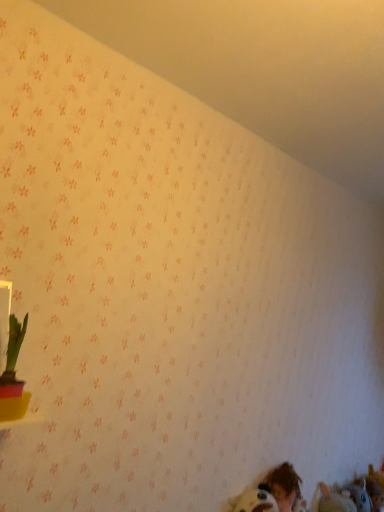
Measure the distance between fuzzy brown stuffed toy at lower right, the 1th animal when ordered from left to right, and camera.

The depth of fuzzy brown stuffed toy at lower right, the 1th animal when ordered from left to right, is 1.84 meters.

I want to click on green leafy plant in pink pot at left, so click(x=13, y=375).

This screenshot has height=512, width=384. Identify the location of brown plush toy at lower right, which is the second animal in front-to-back order. (375, 488).

Is brown plush toy at lower right, which is the second animal in front-to-back order, directly adjacent to green leafy plant in pink pot at left?

They are not placed beside each other.

Is brown plush toy at lower right, which is the second animal in front-to-back order, positioned with its back to green leafy plant in pink pot at left?

No, brown plush toy at lower right, which is the second animal in front-to-back order, is not facing away from green leafy plant in pink pot at left.

From the image's perspective, is brown plush toy at lower right, which is the second animal in front-to-back order, under green leafy plant in pink pot at left?

Yes, from the image's perspective, brown plush toy at lower right, which is the second animal in front-to-back order, is below green leafy plant in pink pot at left.

Is fuzzy brown stuffed toy at lower right, the second animal positioned from the right, located within green leafy plant in pink pot at left?

That's incorrect, fuzzy brown stuffed toy at lower right, the second animal positioned from the right, is not inside green leafy plant in pink pot at left.

From the image's perspective, is green leafy plant in pink pot at left positioned above or below fuzzy brown stuffed toy at lower right, the second animal positioned from the right?

green leafy plant in pink pot at left is situated higher than fuzzy brown stuffed toy at lower right, the second animal positioned from the right, in the image.

Is green leafy plant in pink pot at left taller or shorter than fuzzy brown stuffed toy at lower right, the 1th animal when ordered from left to right?

Clearly, green leafy plant in pink pot at left is taller compared to fuzzy brown stuffed toy at lower right, the 1th animal when ordered from left to right.

From a real-world perspective, is brown hair at lower right over green leafy plant in pink pot at left?

No, from a real-world perspective, brown hair at lower right is not above green leafy plant in pink pot at left.

Between point (290, 464) and point (3, 415), which one is positioned in front?

The point (3, 415) is closer to the camera.

Does brown hair at lower right turn towards green leafy plant in pink pot at left?

No, brown hair at lower right is not facing towards green leafy plant in pink pot at left.

Which of these two, brown hair at lower right or green leafy plant in pink pot at left, stands taller?

With more height is brown hair at lower right.

From the picture: How far apart are brown hair at lower right and brown plush toy at lower right, which is counted as the 1th animal, starting from the back?

brown hair at lower right and brown plush toy at lower right, which is counted as the 1th animal, starting from the back, are 26.25 inches apart from each other.

Is brown hair at lower right positioned before brown plush toy at lower right, arranged as the 2th animal when viewed from the left?

Yes, it is in front of brown plush toy at lower right, arranged as the 2th animal when viewed from the left.

Can you confirm if brown hair at lower right is bigger than brown plush toy at lower right, which appears as the first animal when viewed from the right?

Correct, brown hair at lower right is larger in size than brown plush toy at lower right, which appears as the first animal when viewed from the right.

Considering the positions of points (271, 480) and (369, 493), is point (271, 480) farther from camera compared to point (369, 493)?

No, (271, 480) is closer to viewer.

Is point (292, 490) closer to camera compared to point (320, 508)?

Yes, point (292, 490) is in front of point (320, 508).

Consider the image. Is brown hair at lower right taller than fuzzy brown stuffed toy at lower right, marked as the 2th animal in a back-to-front arrangement?

Indeed, brown hair at lower right has a greater height compared to fuzzy brown stuffed toy at lower right, marked as the 2th animal in a back-to-front arrangement.

Considering their positions, is brown hair at lower right located in front of or behind fuzzy brown stuffed toy at lower right, the second animal positioned from the right?

Clearly, brown hair at lower right is in front of fuzzy brown stuffed toy at lower right, the second animal positioned from the right.

How far apart are brown hair at lower right and fuzzy brown stuffed toy at lower right, the 1th animal when ordered from left to right?

11.24 inches.

Considering the positions of points (328, 494) and (368, 479), is point (328, 494) farther from camera compared to point (368, 479)?

No.

Consider the image. Considering the relative positions of fuzzy brown stuffed toy at lower right, which is the 1th animal in front-to-back order, and brown plush toy at lower right, which is the second animal in front-to-back order, in the image provided, is fuzzy brown stuffed toy at lower right, which is the 1th animal in front-to-back order, to the right of brown plush toy at lower right, which is the second animal in front-to-back order, from the viewer's perspective?

No, fuzzy brown stuffed toy at lower right, which is the 1th animal in front-to-back order, is not to the right of brown plush toy at lower right, which is the second animal in front-to-back order.

Is fuzzy brown stuffed toy at lower right, marked as the 2th animal in a back-to-front arrangement, turned away from brown plush toy at lower right, which appears as the first animal when viewed from the right?

No, fuzzy brown stuffed toy at lower right, marked as the 2th animal in a back-to-front arrangement, is not facing away from brown plush toy at lower right, which appears as the first animal when viewed from the right.

From the image's perspective, is fuzzy brown stuffed toy at lower right, the 1th animal when ordered from left to right, above or below brown plush toy at lower right, which is counted as the 1th animal, starting from the back?

fuzzy brown stuffed toy at lower right, the 1th animal when ordered from left to right, is situated higher than brown plush toy at lower right, which is counted as the 1th animal, starting from the back, in the image.

Which object is closer to the camera taking this photo, green leafy plant in pink pot at left or brown hair at lower right?

green leafy plant in pink pot at left is closer to the camera.

From a real-world perspective, is green leafy plant in pink pot at left under brown hair at lower right?

Incorrect, from a real-world perspective, green leafy plant in pink pot at left is higher than brown hair at lower right.

Considering the sizes of objects green leafy plant in pink pot at left and brown hair at lower right in the image provided, who is smaller, green leafy plant in pink pot at left or brown hair at lower right?

green leafy plant in pink pot at left is smaller.

Is green leafy plant in pink pot at left to the right of brown hair at lower right from the viewer's perspective?

In fact, green leafy plant in pink pot at left is to the left of brown hair at lower right.

Where is `animal that is the 1st one below the green leafy plant in pink pot at left (from a real-world perspective)`? This screenshot has width=384, height=512. animal that is the 1st one below the green leafy plant in pink pot at left (from a real-world perspective) is located at coordinates (375, 488).

In order to click on houseplant that appears above the fuzzy brown stuffed toy at lower right, the second animal positioned from the right (from the image's perspective) in this screenshot , I will do `click(13, 375)`.

Which object lies nearer to the anchor point brown hair at lower right, brown plush toy at lower right, which is counted as the 1th animal, starting from the back, or fuzzy brown stuffed toy at lower right, marked as the 2th animal in a back-to-front arrangement?

Among the two, fuzzy brown stuffed toy at lower right, marked as the 2th animal in a back-to-front arrangement, is located nearer to brown hair at lower right.

Based on their spatial positions, is fuzzy brown stuffed toy at lower right, the second animal positioned from the right, or brown plush toy at lower right, which appears as the first animal when viewed from the right, closer to green leafy plant in pink pot at left?

fuzzy brown stuffed toy at lower right, the second animal positioned from the right, lies closer to green leafy plant in pink pot at left than the other object.

When comparing their distances from green leafy plant in pink pot at left, does fuzzy brown stuffed toy at lower right, marked as the 2th animal in a back-to-front arrangement, or brown hair at lower right seem closer?

brown hair at lower right.

Looking at the image, which one is located further to green leafy plant in pink pot at left, brown hair at lower right or brown plush toy at lower right, arranged as the 2th animal when viewed from the left?

The object further to green leafy plant in pink pot at left is brown plush toy at lower right, arranged as the 2th animal when viewed from the left.

From the image, which object appears to be farther from brown hair at lower right, fuzzy brown stuffed toy at lower right, which is the 1th animal in front-to-back order, or green leafy plant in pink pot at left?

Based on the image, green leafy plant in pink pot at left appears to be further to brown hair at lower right.

Based on their spatial positions, is green leafy plant in pink pot at left or brown hair at lower right further from fuzzy brown stuffed toy at lower right, the 1th animal when ordered from left to right?

The object further to fuzzy brown stuffed toy at lower right, the 1th animal when ordered from left to right, is green leafy plant in pink pot at left.

Considering their positions, is brown hair at lower right positioned closer to brown plush toy at lower right, which is the second animal in front-to-back order, than fuzzy brown stuffed toy at lower right, marked as the 2th animal in a back-to-front arrangement?

The object closer to brown plush toy at lower right, which is the second animal in front-to-back order, is fuzzy brown stuffed toy at lower right, marked as the 2th animal in a back-to-front arrangement.

Considering their positions, is brown plush toy at lower right, which is the second animal in front-to-back order, positioned closer to brown hair at lower right than green leafy plant in pink pot at left?

brown plush toy at lower right, which is the second animal in front-to-back order, is positioned closer to the anchor brown hair at lower right.

Image resolution: width=384 pixels, height=512 pixels. In order to click on person situated between green leafy plant in pink pot at left and brown plush toy at lower right, which is the second animal in front-to-back order, from left to right in this screenshot , I will do `click(283, 486)`.

This screenshot has width=384, height=512. Find the location of `person between green leafy plant in pink pot at left and fuzzy brown stuffed toy at lower right, which is the 1th animal in front-to-back order`. person between green leafy plant in pink pot at left and fuzzy brown stuffed toy at lower right, which is the 1th animal in front-to-back order is located at coordinates (283, 486).

The image size is (384, 512). Find the location of `animal between brown hair at lower right and brown plush toy at lower right, which is the second animal in front-to-back order, from left to right`. animal between brown hair at lower right and brown plush toy at lower right, which is the second animal in front-to-back order, from left to right is located at coordinates (332, 500).

Where is `animal between green leafy plant in pink pot at left and brown plush toy at lower right, which is the second animal in front-to-back order, from left to right`? The height and width of the screenshot is (512, 384). animal between green leafy plant in pink pot at left and brown plush toy at lower right, which is the second animal in front-to-back order, from left to right is located at coordinates (332, 500).